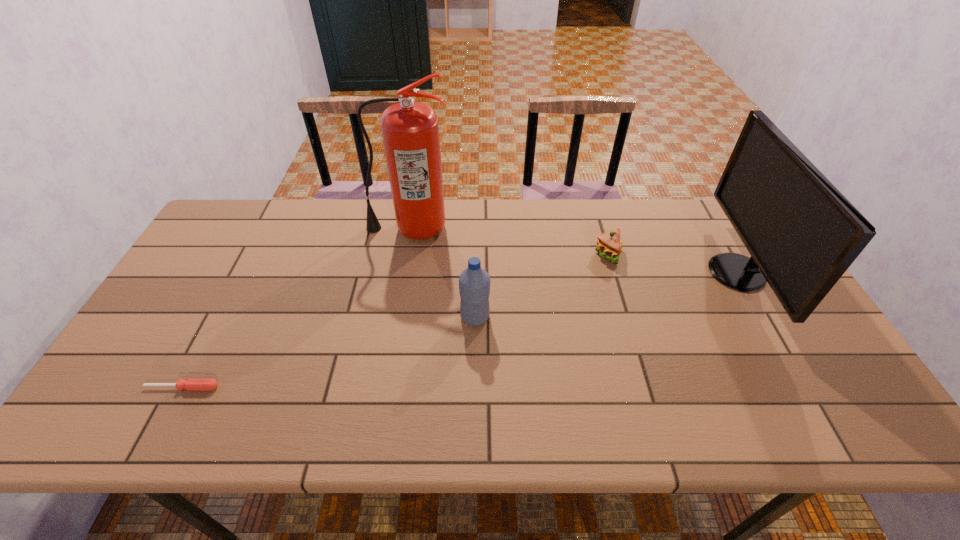
I want to click on free space located on the instruction side of the tallest object, so click(395, 316).

Locate an element on the screen. The image size is (960, 540). free space located 0.260m on the front-facing side of the rightmost object is located at coordinates (622, 273).

Identify the location of vacant space located 0.050m on the front-facing side of the rightmost object. The height and width of the screenshot is (540, 960). (693, 273).

Identify the location of vacant space located on the front-facing side of the rightmost object. Image resolution: width=960 pixels, height=540 pixels. (693, 273).

The image size is (960, 540). I want to click on free location located 0.090m on the left of the third object from left to right, so click(x=427, y=317).

What are the coordinates of `blank space located on the left of the fourth tallest object` in the screenshot? It's located at (542, 254).

Find the location of a particular element. Image resolution: width=960 pixels, height=540 pixels. vacant space located 0.120m on the right of the shortest object is located at coordinates (270, 387).

This screenshot has height=540, width=960. I want to click on fire extinguisher at the far edge, so click(x=410, y=131).

What are the coordinates of `computer monitor that is at the far edge` in the screenshot? It's located at (802, 233).

Where is `sandwich located in the far edge section of the desktop`? Image resolution: width=960 pixels, height=540 pixels. sandwich located in the far edge section of the desktop is located at coordinates (609, 245).